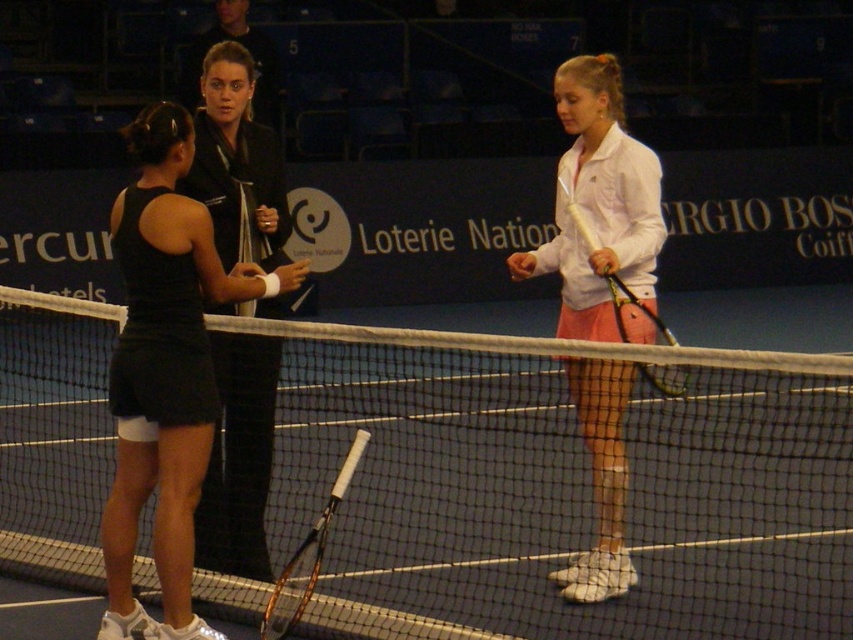
Does white mesh net at center have a lesser width compared to yellow grip tennis racket at center?

No, white mesh net at center is not thinner than yellow grip tennis racket at center.

You are a GUI agent. You are given a task and a screenshot of the screen. Output one action in this format:
    pyautogui.click(x=<x>, y=<y>)
    Task: Click on the white mesh net at center
    
    Given the screenshot: What is the action you would take?
    pyautogui.click(x=560, y=488)

Find the location of a particular element. white matte tennis racket at center is located at coordinates (598, 204).

Between point (556, 269) and point (360, 456), which one is positioned in front?

Point (556, 269)

This screenshot has height=640, width=853. In order to click on white matte tennis racket at center in this screenshot , I will do `click(598, 204)`.

Consider the image. Is black matte tennis skirt at left taller than white matte tennis racket at center?

No.

Is point (178, 435) closer to viewer compared to point (593, 296)?

Yes, it is in front of point (593, 296).

Which is in front, point (173, 307) or point (560, 211)?

Point (173, 307) is more forward.

I want to click on black matte tennis skirt at left, so click(x=165, y=372).